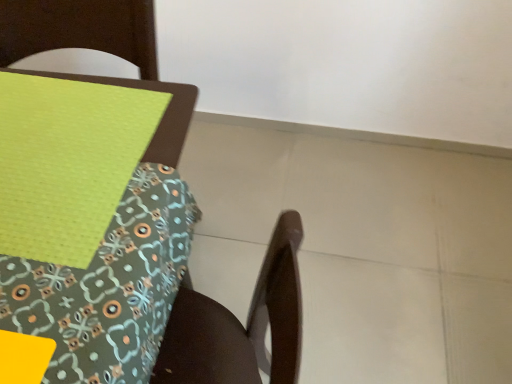
Question: Is green fabric placemat at upper left surrounding wooden chair at lower right?

Choices:
 (A) no
 (B) yes

Answer: (A)

Question: Does green fabric placemat at upper left have a lesser width compared to wooden chair at lower right?

Choices:
 (A) yes
 (B) no

Answer: (A)

Question: Is green fabric placemat at upper left wider than wooden chair at lower right?

Choices:
 (A) no
 (B) yes

Answer: (A)

Question: Would you say green fabric placemat at upper left is a long distance from wooden chair at lower right?

Choices:
 (A) yes
 (B) no

Answer: (B)

Question: Is green fabric placemat at upper left positioned before wooden chair at lower right?

Choices:
 (A) yes
 (B) no

Answer: (B)

Question: From a real-world perspective, is green fabric placemat at upper left positioned over wooden chair at lower right based on gravity?

Choices:
 (A) yes
 (B) no

Answer: (A)

Question: Is wooden chair at lower right smaller than green fabric placemat at upper left?

Choices:
 (A) no
 (B) yes

Answer: (A)

Question: Would you say wooden chair at lower right is outside green fabric placemat at upper left?

Choices:
 (A) no
 (B) yes

Answer: (B)

Question: Considering the relative sizes of wooden chair at lower right and green fabric placemat at upper left in the image provided, is wooden chair at lower right wider than green fabric placemat at upper left?

Choices:
 (A) yes
 (B) no

Answer: (A)

Question: Is wooden chair at lower right facing towards green fabric placemat at upper left?

Choices:
 (A) no
 (B) yes

Answer: (B)

Question: Considering the relative sizes of wooden chair at lower right and green fabric placemat at upper left in the image provided, is wooden chair at lower right bigger than green fabric placemat at upper left?

Choices:
 (A) no
 (B) yes

Answer: (B)

Question: From a real-world perspective, is wooden chair at lower right physically above green fabric placemat at upper left?

Choices:
 (A) no
 (B) yes

Answer: (A)

Question: Would you say wooden chair at lower right is inside or outside green fabric placemat at upper left?

Choices:
 (A) inside
 (B) outside

Answer: (B)